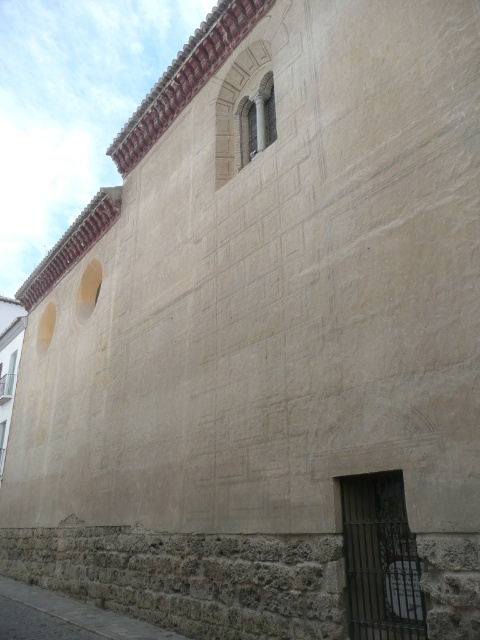
Question: Which point is farther to the camera?

Choices:
 (A) dark metal bars at lower right
 (B) stone arched window at upper center

Answer: (B)

Question: Does dark metal bars at lower right appear on the right side of stone arched window at upper center?

Choices:
 (A) yes
 (B) no

Answer: (A)

Question: Does dark metal bars at lower right have a larger size compared to stone arched window at upper center?

Choices:
 (A) yes
 (B) no

Answer: (A)

Question: In this image, where is dark metal bars at lower right located relative to stone arched window at upper center?

Choices:
 (A) above
 (B) below

Answer: (B)

Question: Which of the following is the farthest from the observer?

Choices:
 (A) (423, 637)
 (B) (269, 106)

Answer: (B)